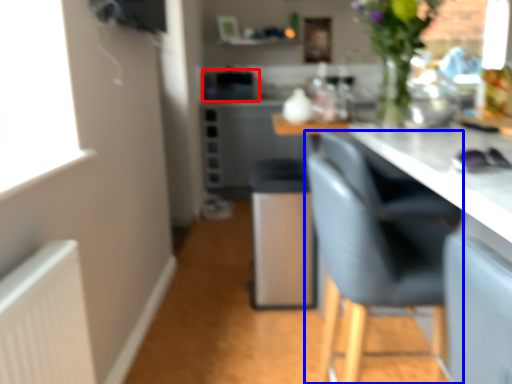
Question: Which point is closer to the camera, appliance (highlighted by a red box) or chair (highlighted by a blue box)?

Choices:
 (A) appliance
 (B) chair

Answer: (B)